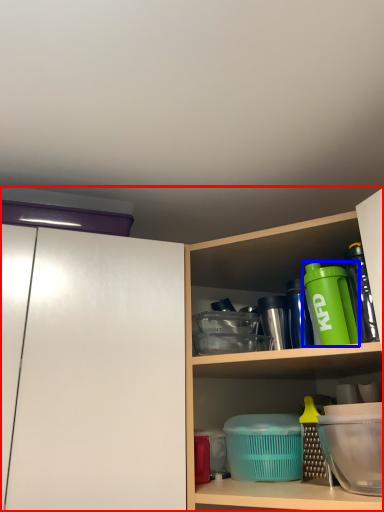
Question: Which object is further to the camera taking this photo, cabinetry (highlighted by a red box) or bottle (highlighted by a blue box)?

Choices:
 (A) cabinetry
 (B) bottle

Answer: (B)